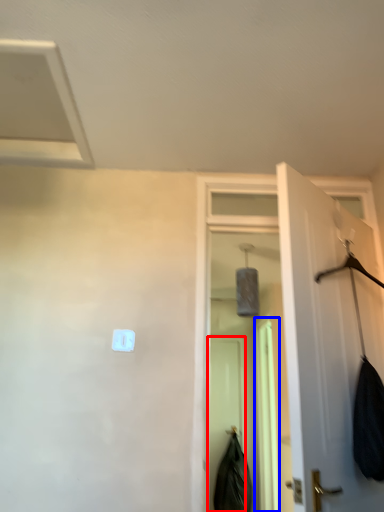
Question: Which object appears farthest to the camera in this image, screen door (highlighted by a red box) or screen door (highlighted by a blue box)?

Choices:
 (A) screen door
 (B) screen door

Answer: (A)